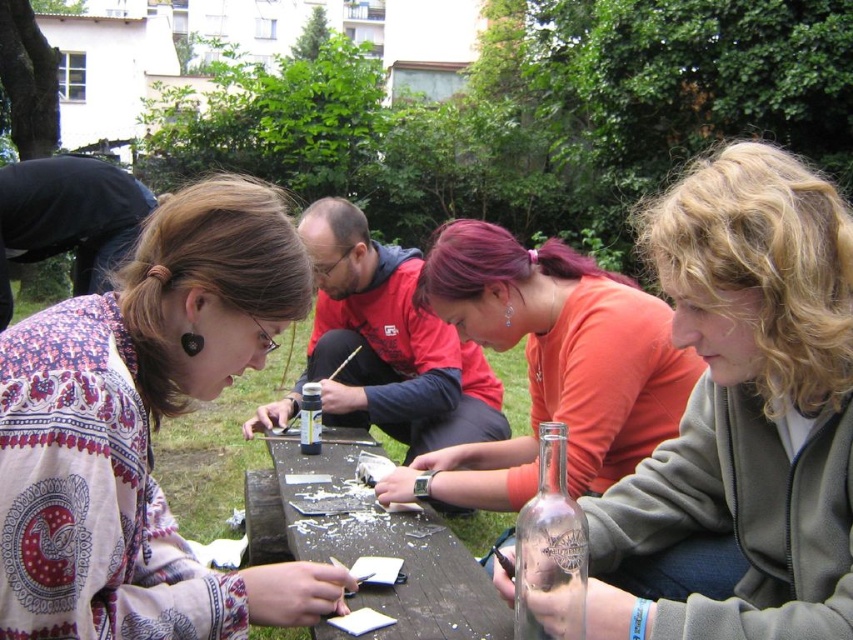
Between point (729, 433) and point (596, 368), which one is positioned behind?

Point (596, 368)

Consider the image. Is the position of translucent glass bottle at center more distant than that of orange cotton shirt at center?

No, it is in front of orange cotton shirt at center.

The width and height of the screenshot is (853, 640). Describe the element at coordinates (746, 406) in the screenshot. I see `translucent glass bottle at center` at that location.

In order to click on translucent glass bottle at center in this screenshot , I will do `click(746, 406)`.

Does patterned fabric shirt at upper left have a greater height compared to translucent glass bottle at center?

Incorrect, patterned fabric shirt at upper left's height is not larger of translucent glass bottle at center's.

Who is more distant from viewer, (x=128, y=464) or (x=665, y=244)?

Point (x=665, y=244)

At what (x,y) coordinates should I click in order to perform the action: click on patterned fabric shirt at upper left. Please return your answer as a coordinate pair (x, y). This screenshot has width=853, height=640. Looking at the image, I should click on pyautogui.click(x=144, y=429).

Between point (109, 572) and point (335, 483), which one is positioned behind?

Positioned behind is point (335, 483).

What do you see at coordinates (144, 429) in the screenshot? This screenshot has width=853, height=640. I see `patterned fabric shirt at upper left` at bounding box center [144, 429].

Is point (262, 230) positioned after point (300, 454)?

No, (262, 230) is closer to viewer.

The image size is (853, 640). I want to click on patterned fabric shirt at upper left, so click(144, 429).